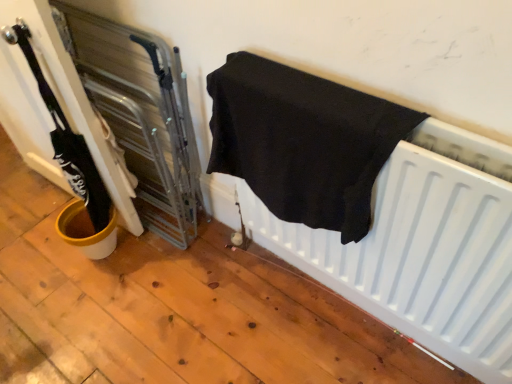
Question: In terms of height, does black fabric towel at center look taller or shorter compared to white matte radiator at lower right?

Choices:
 (A) tall
 (B) short

Answer: (A)

Question: Do you think black fabric towel at center is within white matte radiator at lower right, or outside of it?

Choices:
 (A) outside
 (B) inside

Answer: (A)

Question: Considering the positions of black fabric towel at center and white matte radiator at lower right in the image, is black fabric towel at center bigger or smaller than white matte radiator at lower right?

Choices:
 (A) big
 (B) small

Answer: (A)

Question: Visually, is white matte radiator at lower right positioned to the left or to the right of black fabric towel at center?

Choices:
 (A) left
 (B) right

Answer: (B)

Question: From a real-world perspective, is white matte radiator at lower right positioned above or below black fabric towel at center?

Choices:
 (A) above
 (B) below

Answer: (B)

Question: Considering their positions, is white matte radiator at lower right located in front of or behind black fabric towel at center?

Choices:
 (A) behind
 (B) front

Answer: (A)

Question: Looking at the image, does white matte radiator at lower right seem bigger or smaller compared to black fabric towel at center?

Choices:
 (A) small
 (B) big

Answer: (A)